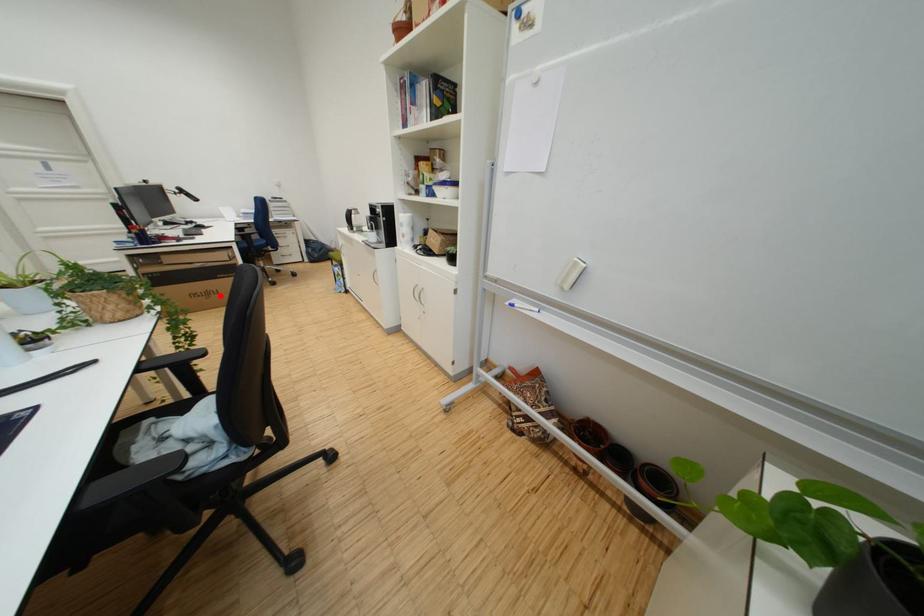
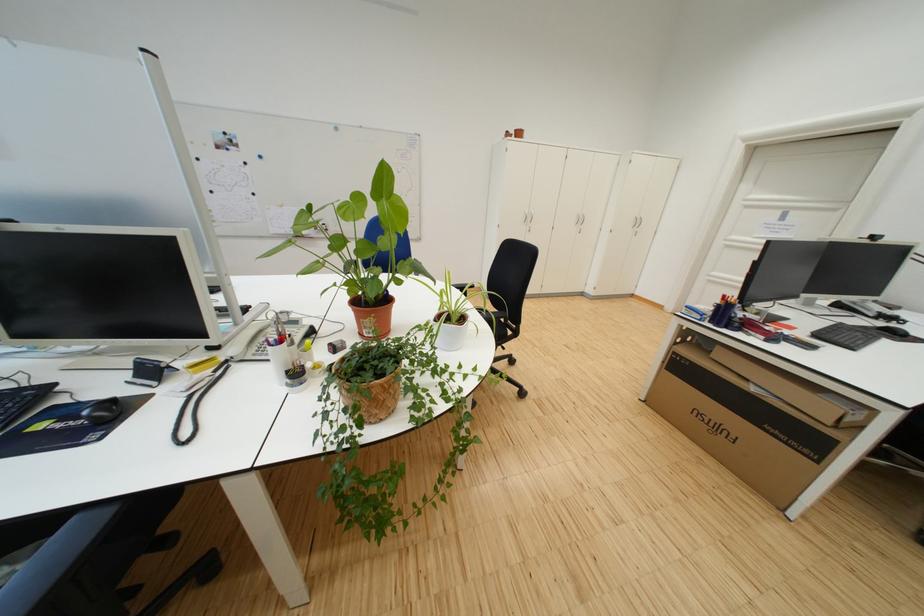
Question: I am providing you with two images of the same scene from different viewpoints. In image1, a red point is highlighted. Considering the same 3D point in image2, which of the following is correct?

Choices:
 (A) It is closer
 (B) It is farther

Answer: (A)